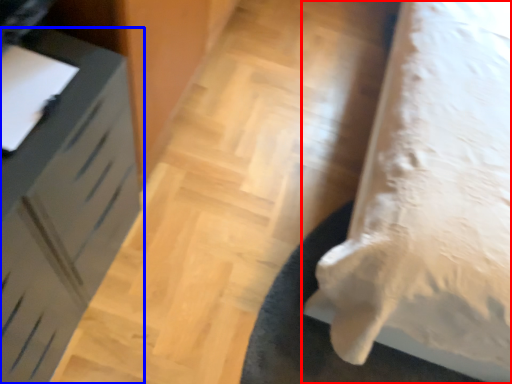
Question: Which object appears closest to the camera in this image, furniture (highlighted by a red box) or furniture (highlighted by a blue box)?

Choices:
 (A) furniture
 (B) furniture

Answer: (A)